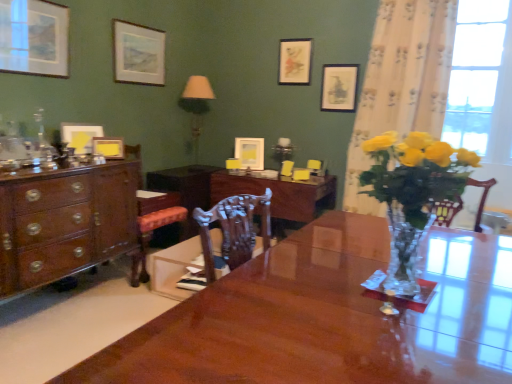
Locate an element on the screen. Image resolution: width=512 pixels, height=384 pixels. vacant location below translucent glass vase at center (from a real-world perspective) is located at coordinates (408, 292).